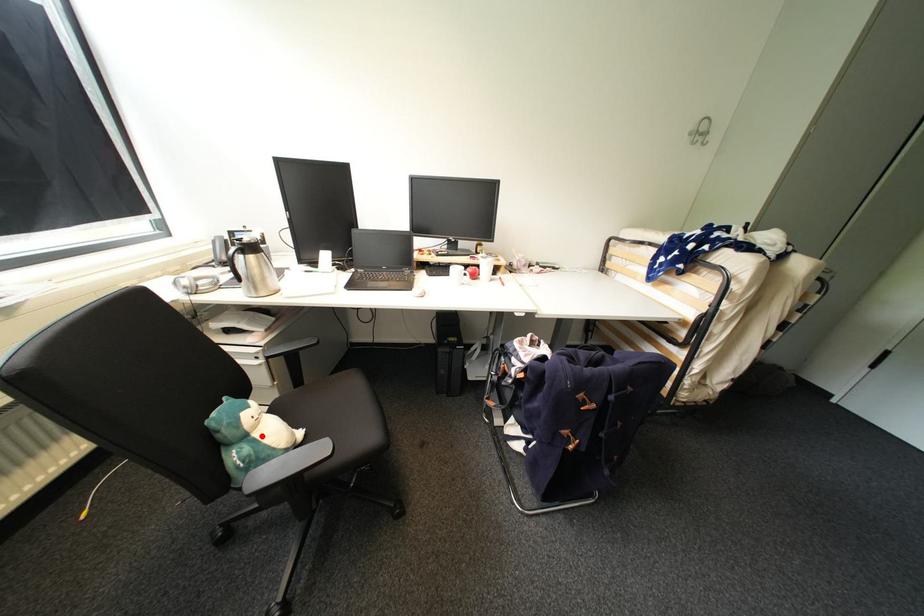
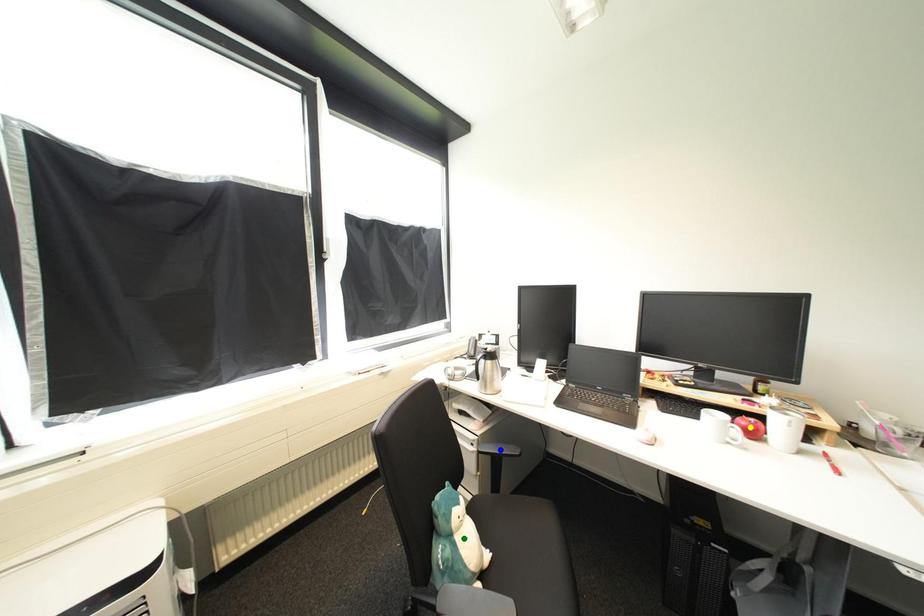
Question: I am providing you with two images of the same scene from different viewpoints. A red point is marked on the first image. You are given multiple points on the second image. Can you choose the point in image 2 that corresponds to the point in image 1?

Choices:
 (A) blue point
 (B) yellow point
 (C) green point

Answer: (C)